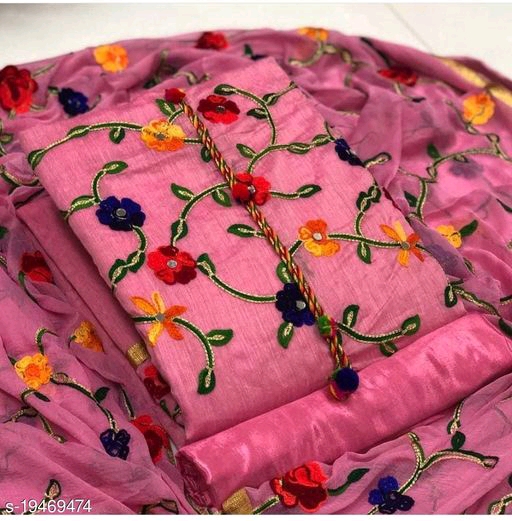
This screenshot has width=512, height=521. In order to click on pink fabric in this screenshot , I will do `click(250, 373)`.